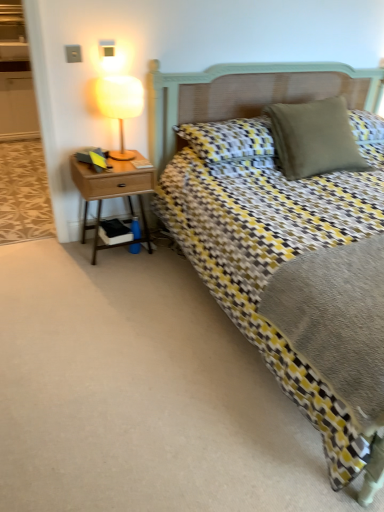
Question: From a real-world perspective, relative to woodennightstand at left, is matte yellow lampshade at upper left vertically above or below?

Choices:
 (A) above
 (B) below

Answer: (A)

Question: Is point (119, 156) closer or farther from the camera than point (134, 178)?

Choices:
 (A) farther
 (B) closer

Answer: (A)

Question: Which of these objects is positioned farthest from the matte beige pillow at upper right, placed as the second pillow when sorted from left to right?

Choices:
 (A) yellow checkered fabric bed at center
 (B) matte yellow lampshade at upper left
 (C) woodennightstand at left
 (D) textured beige pillow at center, which is the first pillow in left-to-right order

Answer: (B)

Question: Considering the real-world distances, which object is farthest from the matte beige pillow at upper right, placed as the second pillow when sorted from left to right?

Choices:
 (A) woodennightstand at left
 (B) textured beige pillow at center, the 2th pillow when ordered from right to left
 (C) matte yellow lampshade at upper left
 (D) yellow checkered fabric bed at center

Answer: (C)